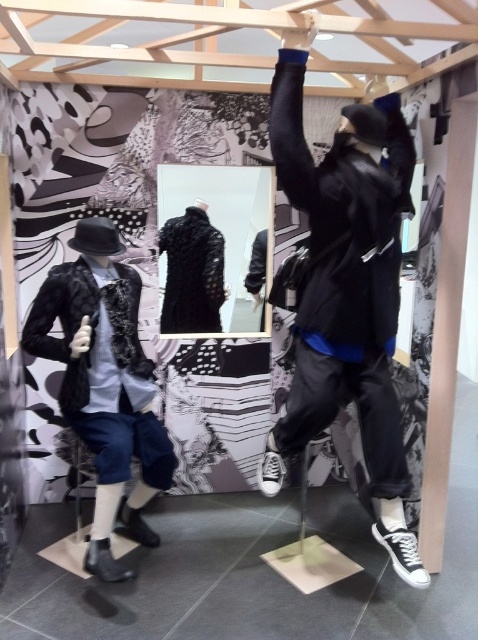
Question: Which point appears closest to the camera in this image?

Choices:
 (A) (65, 326)
 (B) (356, 273)

Answer: (B)

Question: Which of the following is the closest to the observer?

Choices:
 (A) 104,483
 (B) 357,202

Answer: (B)

Question: Does matte black jacket at upper right have a larger size compared to matte black jacket at left?

Choices:
 (A) yes
 (B) no

Answer: (A)

Question: Which of the following is the farthest from the observer?

Choices:
 (A) (147, 371)
 (B) (399, 172)

Answer: (A)

Question: Can you confirm if matte black jacket at upper right is bigger than matte black jacket at left?

Choices:
 (A) yes
 (B) no

Answer: (A)

Question: In this image, where is matte black jacket at upper right located relative to matte black jacket at left?

Choices:
 (A) right
 (B) left

Answer: (A)